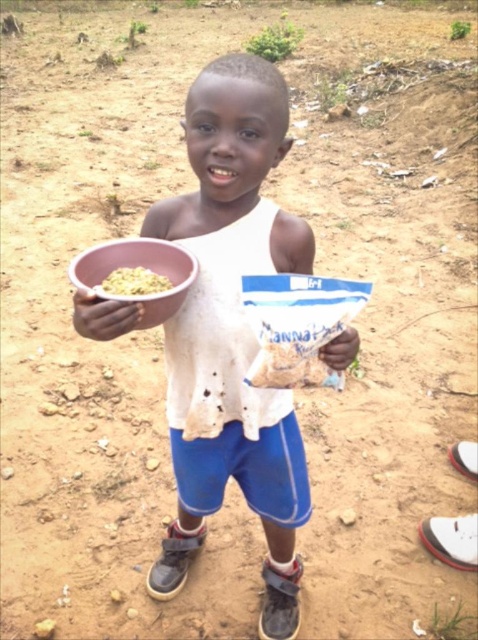
Does white matte shirt at center have a smaller size compared to blue cotton shorts at center?

No, white matte shirt at center is not smaller than blue cotton shorts at center.

Does white matte shirt at center have a lesser width compared to blue cotton shorts at center?

No, white matte shirt at center is not thinner than blue cotton shorts at center.

Describe the element at coordinates (232, 332) in the screenshot. The image size is (478, 640). I see `white matte shirt at center` at that location.

Where is `white matte shirt at center`? The image size is (478, 640). white matte shirt at center is located at coordinates (232, 332).

Is pink plastic bowl at lower left positioned at the back of matte plastic bowl at left?

No.

Who is more distant from viewer, (166, 316) or (77, 291)?

The point (166, 316) is more distant.

Is point (171, 260) farther from viewer compared to point (80, 323)?

Yes, point (171, 260) is behind point (80, 323).

Where is `pink plastic bowl at lower left`? pink plastic bowl at lower left is located at coordinates (138, 268).

Is white matte shirt at center thinner than yellow matte rice at upper left?

No, white matte shirt at center is not thinner than yellow matte rice at upper left.

Is point (196, 541) behind point (121, 284)?

Yes, it is.

Between point (228, 362) and point (110, 291), which one is positioned behind?

Point (228, 362)

Find the location of a particular element. This screenshot has height=640, width=478. white matte shirt at center is located at coordinates (232, 332).